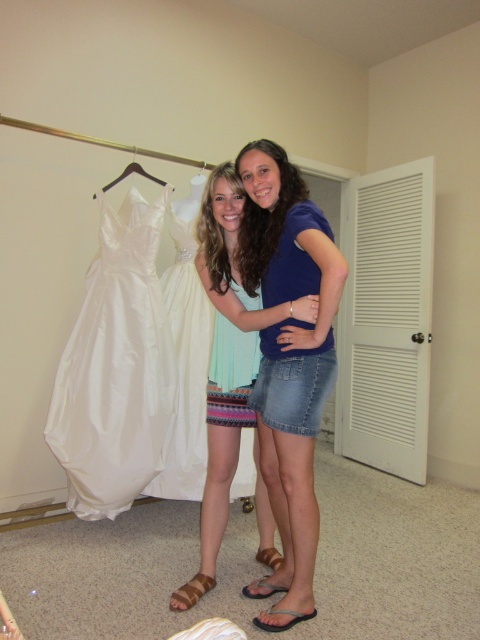
Does black fabric sandal at lower center have a lesser width compared to metallic silver hanger at upper left?

No, black fabric sandal at lower center is not thinner than metallic silver hanger at upper left.

Which of these two, black fabric sandal at lower center or metallic silver hanger at upper left, stands shorter?

Standing shorter between the two is black fabric sandal at lower center.

Which is in front, point (307, 612) or point (201, 182)?

Point (307, 612) is more forward.

Where is `black fabric sandal at lower center`? This screenshot has width=480, height=640. black fabric sandal at lower center is located at coordinates (284, 624).

Between blue denim skirt at center and black plastic hanger at upper left, which one is positioned lower?

Positioned lower is blue denim skirt at center.

Does blue denim skirt at center appear on the right side of black plastic hanger at upper left?

Indeed, blue denim skirt at center is positioned on the right side of black plastic hanger at upper left.

This screenshot has height=640, width=480. What do you see at coordinates (289, 348) in the screenshot?
I see `blue denim skirt at center` at bounding box center [289, 348].

In order to click on blue denim skirt at center in this screenshot , I will do `click(289, 348)`.

Can you confirm if light blue woven fabric dress at center is wider than brown leather sandal at lower center?

Yes, light blue woven fabric dress at center is wider than brown leather sandal at lower center.

Can you confirm if light blue woven fabric dress at center is positioned above brown leather sandal at lower center?

Indeed, light blue woven fabric dress at center is positioned over brown leather sandal at lower center.

Where is `light blue woven fabric dress at center`? The height and width of the screenshot is (640, 480). light blue woven fabric dress at center is located at coordinates (231, 374).